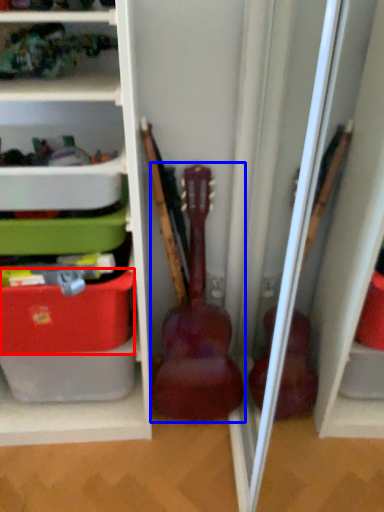
Question: Among these objects, which one is farthest to the camera, storage box (highlighted by a red box) or guitar (highlighted by a blue box)?

Choices:
 (A) storage box
 (B) guitar

Answer: (B)